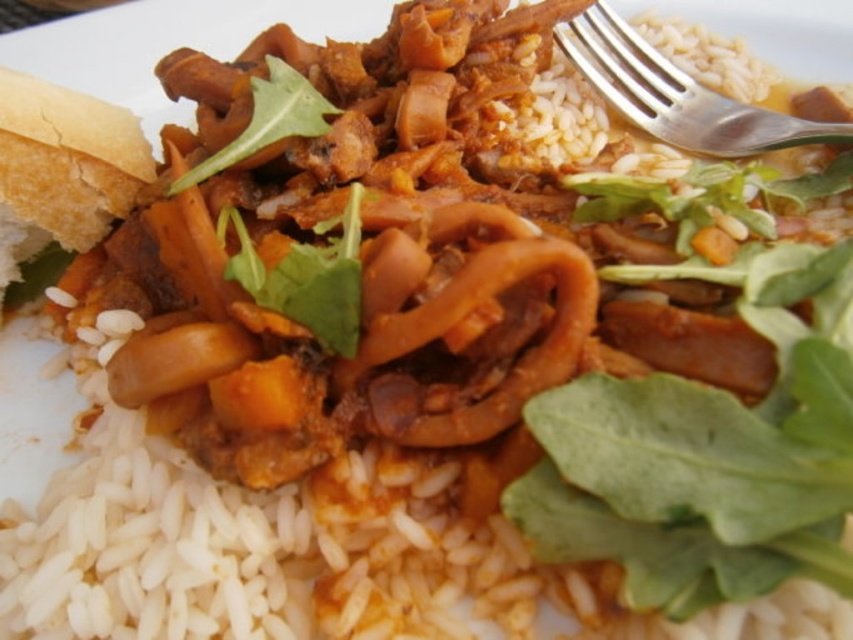
Question: Which point is closer to the camera?

Choices:
 (A) white bread at left
 (B) green leafy vegetable at center

Answer: (B)

Question: Is white bread at left below green leafy at center?

Choices:
 (A) no
 (B) yes

Answer: (B)

Question: Which object is closer to the camera taking this photo?

Choices:
 (A) green leafy vegetable at center
 (B) green leafy at center
 (C) white bread at left
 (D) silver metallic fork at upper right

Answer: (A)

Question: Is silver metallic fork at upper right thinner than green leafy vegetable at center?

Choices:
 (A) no
 (B) yes

Answer: (A)

Question: Which point appears farthest from the camera in this image?

Choices:
 (A) (660, 76)
 (B) (306, 113)
 (C) (288, 288)

Answer: (A)

Question: Is white bread at left bigger than green leafy at center?

Choices:
 (A) yes
 (B) no

Answer: (A)